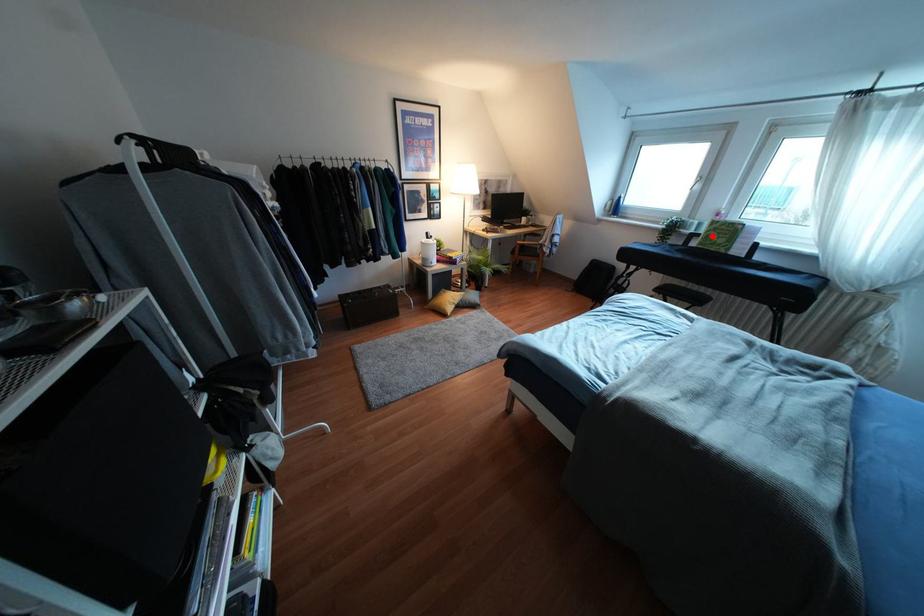
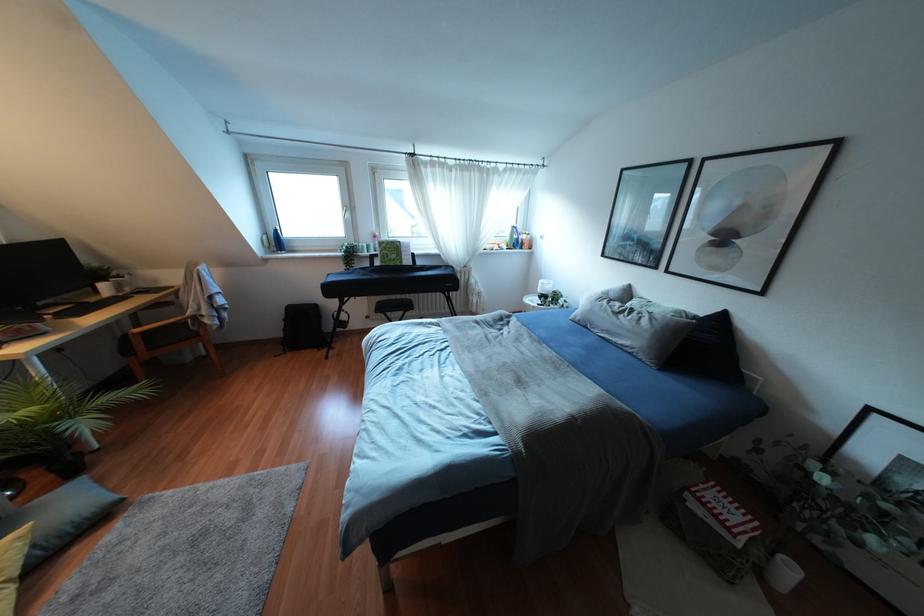
Find the pixel in the second image that matches the highlighted location in the first image.

(385, 254)